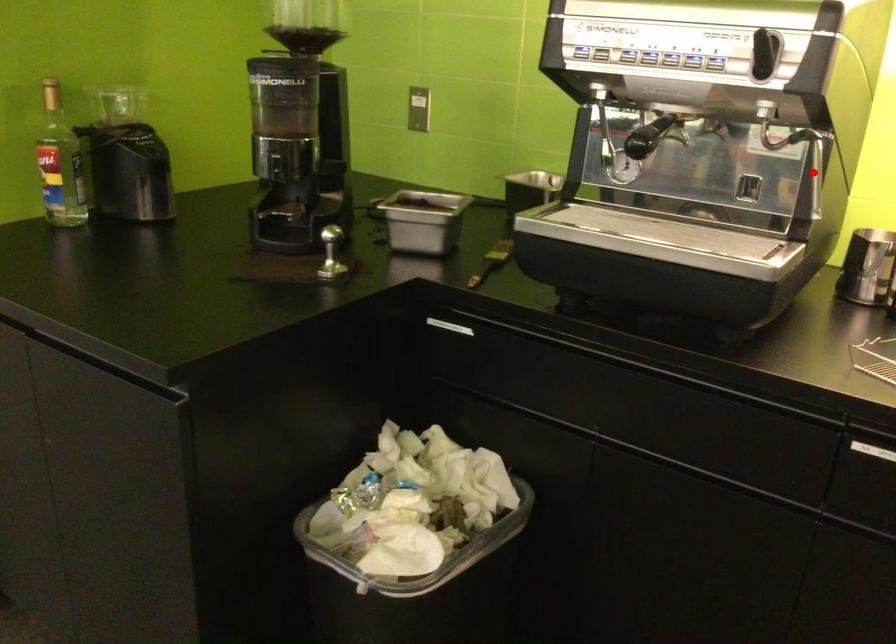
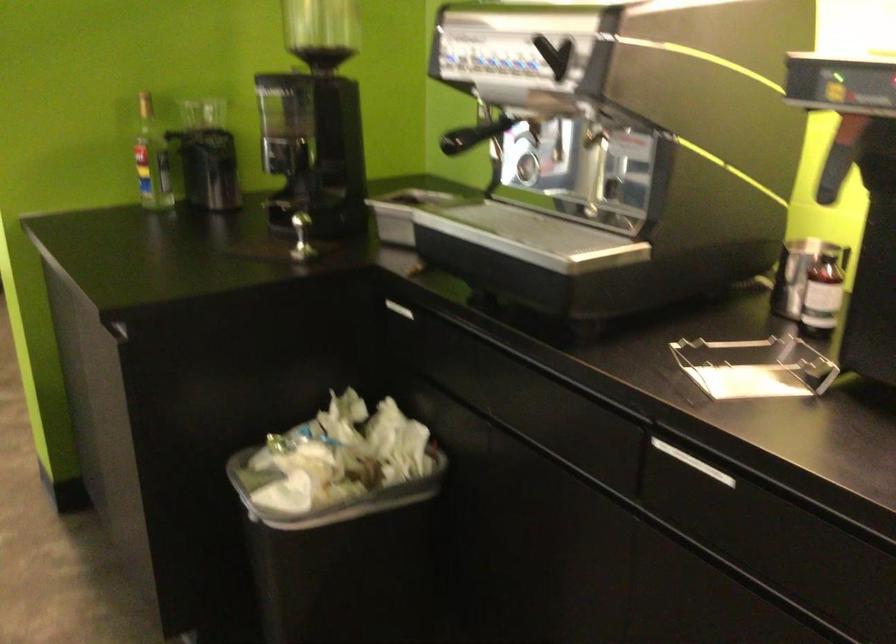
The point at the highlighted location is marked in the first image. Where is the corresponding point in the second image?

(592, 171)